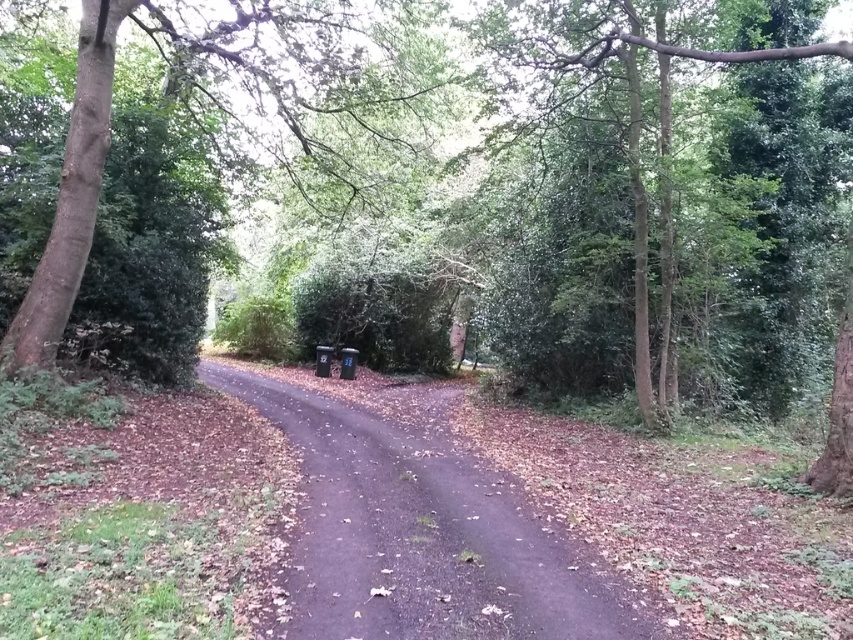
You are a hiker carrying a 1.5 meter long backpack. You come across the brown dirt track at center and the green leafy tree at upper center. Which one do you think you can pass through without needing to adjust your backpack?

The brown dirt track at center has a larger size compared to the green leafy tree at upper center, so you can pass through the brown dirt track at center without needing to adjust your backpack.

You are a hiker walking along the path and want to take a photo of the brown textured tree at left and the green leafy tree at upper center. Which tree is closer to the camera?

The brown textured tree at left is positioned under the green leafy tree at upper center, so the brown textured tree at left is closer to the camera.